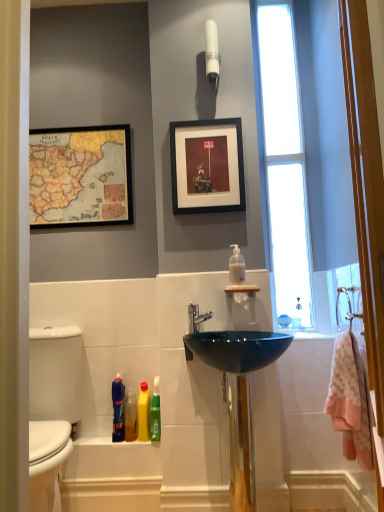
Question: Is point (198, 330) positioned closer to the camera than point (115, 415)?

Choices:
 (A) farther
 (B) closer

Answer: (B)

Question: Is satin nickel faucet at center in front of or behind blue glossy bottle at lower left, acting as the 5th cleaning product starting from the right, in the image?

Choices:
 (A) front
 (B) behind

Answer: (A)

Question: Which object is positioned farthest from the yellow matte bottle at lower center, marked as the third cleaning product in a right-to-left arrangement?

Choices:
 (A) pink cotton bath towel at right
 (B) transparent glass window at upper right
 (C) translucent plastic bottle at lower center, acting as the 2th cleaning product starting from the left
 (D) wooden map at upper left, positioned as the second picture frame in front-to-back order
 (E) green glossy bottle at lower center, which is the 2th cleaning product in right-to-left order

Answer: (B)

Question: Based on their relative distances, which object is nearer to the green glossy bottle at lower center, which is the 2th cleaning product in right-to-left order?

Choices:
 (A) pink fabric towel at right
 (B) wooden map at upper left, positioned as the 2th picture frame in right-to-left order
 (C) translucent plastic soap dispenser at upper center, which is the 5th cleaning product in left-to-right order
 (D) translucent plastic bottle at lower center, acting as the 2th cleaning product starting from the left
 (E) glossy glass sink at center

Answer: (D)